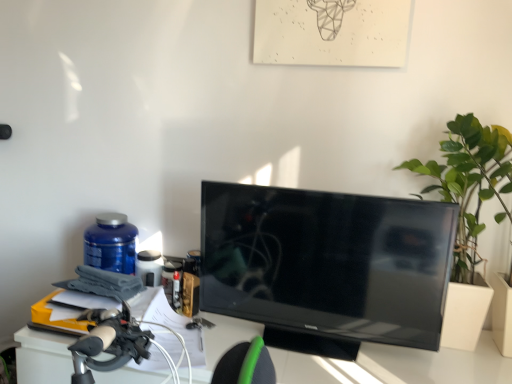
Question: Is black glossy tv at center taller than green leafy plant at right?

Choices:
 (A) yes
 (B) no

Answer: (B)

Question: From a real-world perspective, is black glossy tv at center positioned over green leafy plant at right based on gravity?

Choices:
 (A) no
 (B) yes

Answer: (A)

Question: From a real-world perspective, is black glossy tv at center beneath green leafy plant at right?

Choices:
 (A) yes
 (B) no

Answer: (A)

Question: From the image's perspective, is black glossy tv at center beneath green leafy plant at right?

Choices:
 (A) no
 (B) yes

Answer: (B)

Question: Does black glossy tv at center lie behind green leafy plant at right?

Choices:
 (A) yes
 (B) no

Answer: (B)

Question: Considering the relative sizes of black glossy tv at center and green leafy plant at right in the image provided, is black glossy tv at center bigger than green leafy plant at right?

Choices:
 (A) no
 (B) yes

Answer: (A)

Question: Can you confirm if blue plastic bottle at left is thinner than green leafy plant at right?

Choices:
 (A) no
 (B) yes

Answer: (B)

Question: Considering the relative sizes of blue plastic bottle at left and green leafy plant at right in the image provided, is blue plastic bottle at left taller than green leafy plant at right?

Choices:
 (A) yes
 (B) no

Answer: (B)

Question: Considering the relative positions of blue plastic bottle at left and green leafy plant at right in the image provided, is blue plastic bottle at left to the right of green leafy plant at right from the viewer's perspective?

Choices:
 (A) no
 (B) yes

Answer: (A)

Question: Is blue plastic bottle at left not near green leafy plant at right?

Choices:
 (A) no
 (B) yes

Answer: (B)

Question: Does blue plastic bottle at left turn towards green leafy plant at right?

Choices:
 (A) yes
 (B) no

Answer: (B)

Question: Is blue plastic bottle at left at the left side of green leafy plant at right?

Choices:
 (A) no
 (B) yes

Answer: (B)

Question: Is blue plastic bottle at left located outside black glossy tv at center?

Choices:
 (A) yes
 (B) no

Answer: (A)